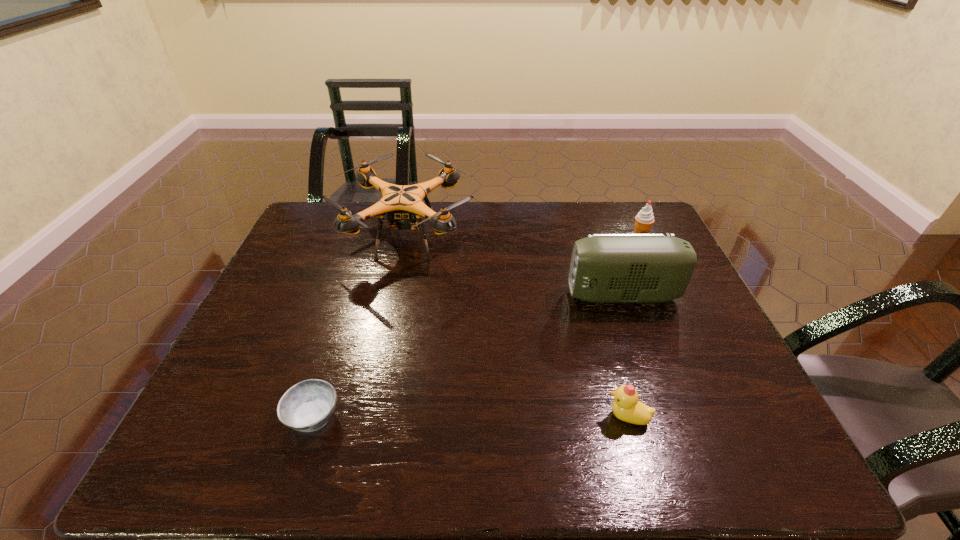
Where is `vacant space located on the front-facing side of the second shortest object`? This screenshot has width=960, height=540. vacant space located on the front-facing side of the second shortest object is located at coordinates (549, 417).

Locate an element on the screen. The image size is (960, 540). vacant space situated 0.230m on the front-facing side of the second shortest object is located at coordinates (496, 417).

Identify the location of free point located on the front-facing side of the second shortest object. The width and height of the screenshot is (960, 540). (425, 417).

I want to click on free space located 0.180m on the back of the shortest object, so click(x=340, y=332).

At what (x,y) coordinates should I click in order to perform the action: click on drone that is at the far edge. Please return your answer as a coordinate pair (x, y). This screenshot has height=540, width=960. Looking at the image, I should click on (402, 204).

Identify the location of icecream located in the far edge section of the desktop. Image resolution: width=960 pixels, height=540 pixels. (643, 221).

The width and height of the screenshot is (960, 540). What are the coordinates of `object at the near edge` in the screenshot? It's located at (307, 406).

Find the location of a particular element. Image resolution: width=960 pixels, height=540 pixels. object at the left edge is located at coordinates (402, 204).

Identify the location of radio_receiver that is at the right edge. (605, 268).

The image size is (960, 540). I want to click on icecream located at the right edge, so click(643, 221).